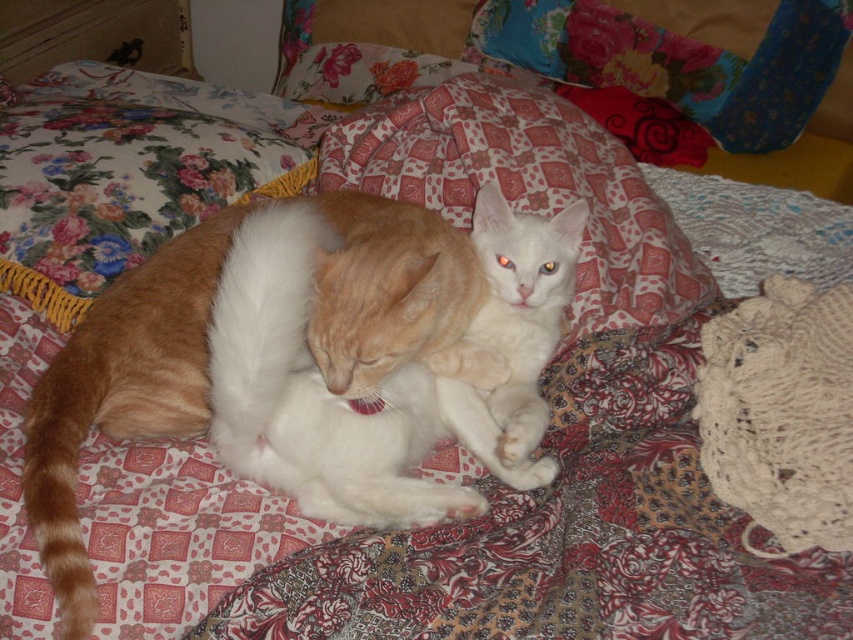
Who is shorter, floral fabric pillow at upper center or white matte cat at center?

With less height is white matte cat at center.

Which is more to the right, floral fabric pillow at upper center or white matte cat at center?

floral fabric pillow at upper center

At what (x,y) coordinates should I click in order to perform the action: click on floral fabric pillow at upper center. Please return your answer as a coordinate pair (x, y). Image resolution: width=853 pixels, height=640 pixels. Looking at the image, I should click on (679, 61).

Does orange fur cat at center appear on the left side of white matte cat at center?

Correct, you'll find orange fur cat at center to the left of white matte cat at center.

Between orange fur cat at center and white matte cat at center, which one has less height?

white matte cat at center is shorter.

Who is more forward, (62, 364) or (509, 257)?

Point (62, 364) is in front.

Locate an element on the screen. The image size is (853, 640). orange fur cat at center is located at coordinates tap(120, 392).

This screenshot has height=640, width=853. I want to click on orange fur cat at center, so click(x=120, y=392).

Looking at this image, can you confirm if orange fur cat at center is smaller than floral fabric pillow at upper center?

Yes.

Describe the element at coordinates (120, 392) in the screenshot. The width and height of the screenshot is (853, 640). I see `orange fur cat at center` at that location.

Where is `orange fur cat at center`? The width and height of the screenshot is (853, 640). orange fur cat at center is located at coordinates (120, 392).